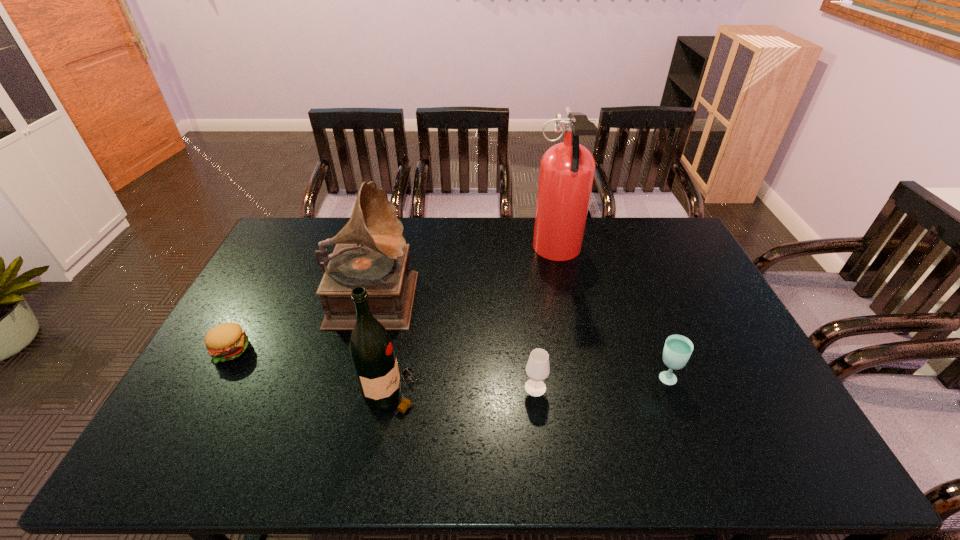
This screenshot has height=540, width=960. I want to click on fire extinguisher, so click(567, 169).

You are a GUI agent. You are given a task and a screenshot of the screen. Output one action in this format:
    pyautogui.click(x=<x>, y=<y>)
    Task: Click on the second object from right to left
    
    Given the screenshot: What is the action you would take?
    pyautogui.click(x=567, y=169)

Image resolution: width=960 pixels, height=540 pixels. I want to click on record player, so click(x=377, y=259).

Locate an element on the screen. wine bottle is located at coordinates pos(371,348).

I want to click on the right glass, so click(677, 350).

Find the location of a particular element. This screenshot has width=960, height=540. the fourth object from left to right is located at coordinates (537, 369).

The width and height of the screenshot is (960, 540). I want to click on the third farthest object, so click(x=227, y=341).

The height and width of the screenshot is (540, 960). I want to click on hamburger, so click(x=227, y=341).

At what (x,y) coordinates should I click in order to perform the action: click on free region located 0.270m on the front of the fire extinguisher. Please return your answer as a coordinate pair (x, y). This screenshot has height=540, width=960. Looking at the image, I should click on (575, 338).

Identify the location of free location located from the horn of the record player. (464, 293).